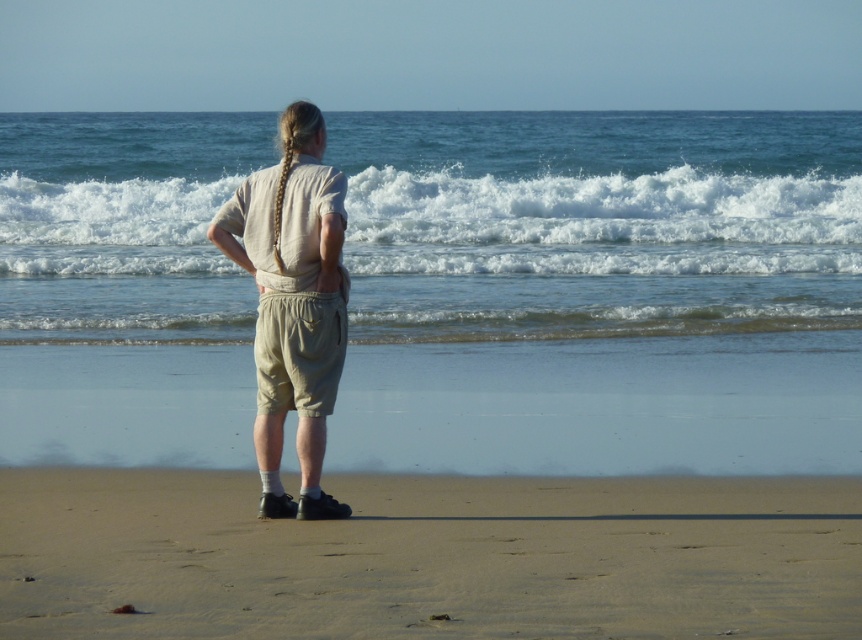
Question: Can you confirm if white frothy wave at upper center is positioned above beige cotton shorts at center?

Choices:
 (A) yes
 (B) no

Answer: (A)

Question: Which object is farther from the camera taking this photo?

Choices:
 (A) sandy beige at lower center
 (B) beige cotton shorts at center

Answer: (B)

Question: Can you confirm if white frothy wave at upper center is positioned to the left of beige cotton shorts at center?

Choices:
 (A) no
 (B) yes

Answer: (A)

Question: Estimate the real-world distances between objects in this image. Which object is closer to the white frothy wave at upper center?

Choices:
 (A) sandy beige at lower center
 (B) beige cotton shorts at center

Answer: (B)

Question: Which point is closer to the camera?

Choices:
 (A) white frothy wave at upper center
 (B) sandy beige at lower center
 (C) beige cotton shorts at center

Answer: (B)

Question: Can you confirm if sandy beige at lower center is positioned above beige cotton shorts at center?

Choices:
 (A) no
 (B) yes

Answer: (A)